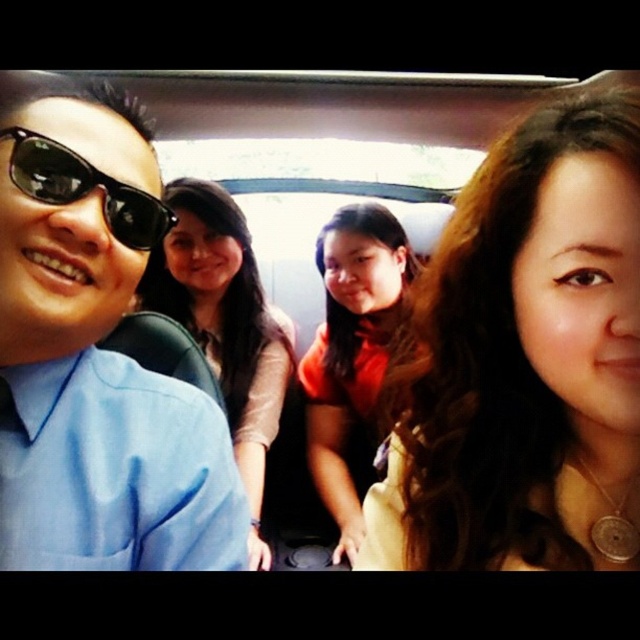
Question: Is matte blue shirt at left below matte brown hair at center?

Choices:
 (A) no
 (B) yes

Answer: (A)

Question: Is matte blue shirt at left thinner than orange matte shirt at center?

Choices:
 (A) no
 (B) yes

Answer: (B)

Question: Which of the following is the closest to the observer?

Choices:
 (A) (237, 428)
 (B) (518, 547)
 (C) (410, 276)
 (D) (42, 339)

Answer: (B)

Question: Is the position of matte gold necklace at center more distant than that of black matte sunglasses at left?

Choices:
 (A) no
 (B) yes

Answer: (A)

Question: Among these points, which one is farthest from the camera?

Choices:
 (A) [x=225, y=538]
 (B) [x=250, y=508]
 (C) [x=449, y=268]
 (D) [x=22, y=186]

Answer: (B)

Question: Which point appears closest to the camera in this image?

Choices:
 (A) (609, 124)
 (B) (372, 397)
 (C) (212, 202)
 (D) (112, 177)

Answer: (A)